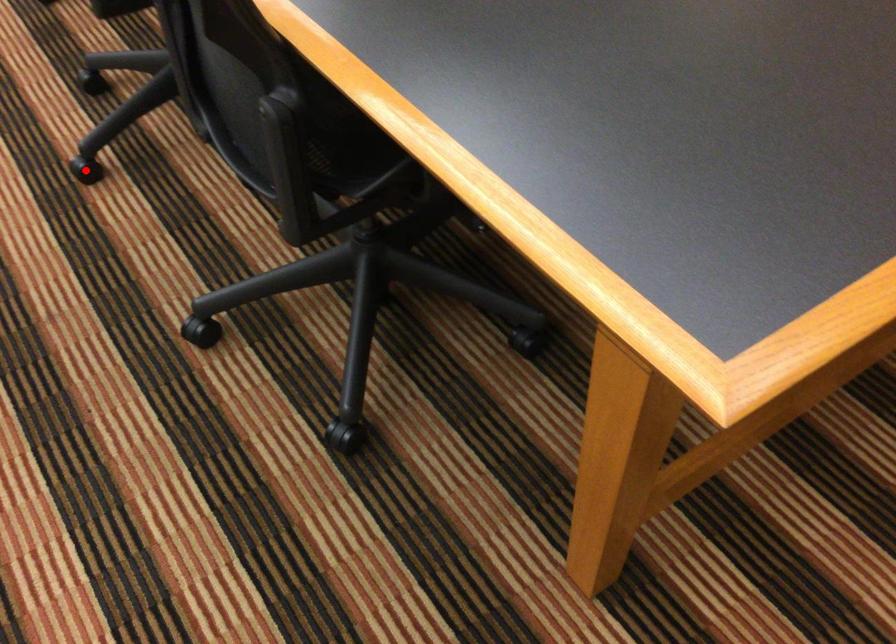
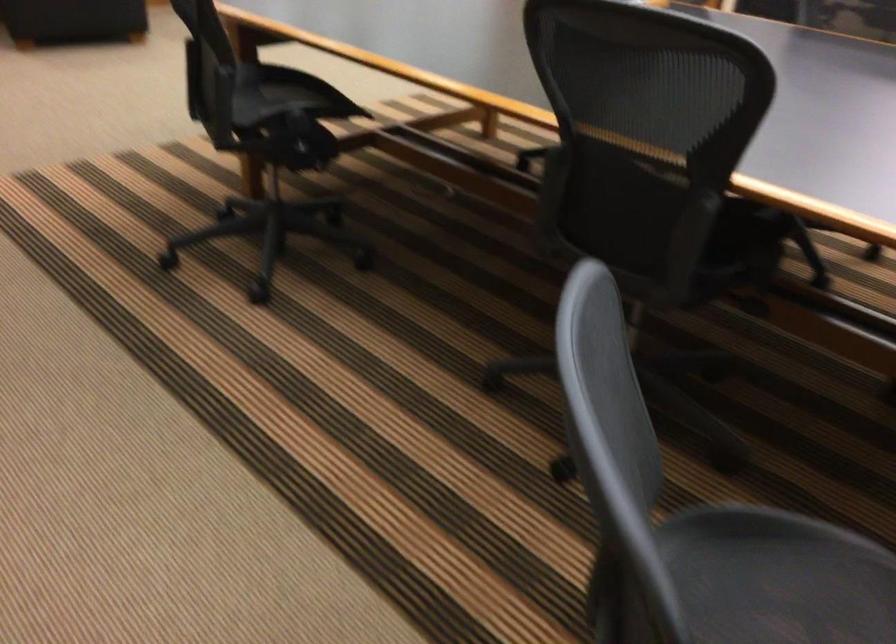
Question: I am providing you with two images of the same scene from different viewpoints. A red point is marked on the first image. Is the red point's position out of view in image 2?

Choices:
 (A) Yes
 (B) No

Answer: (A)